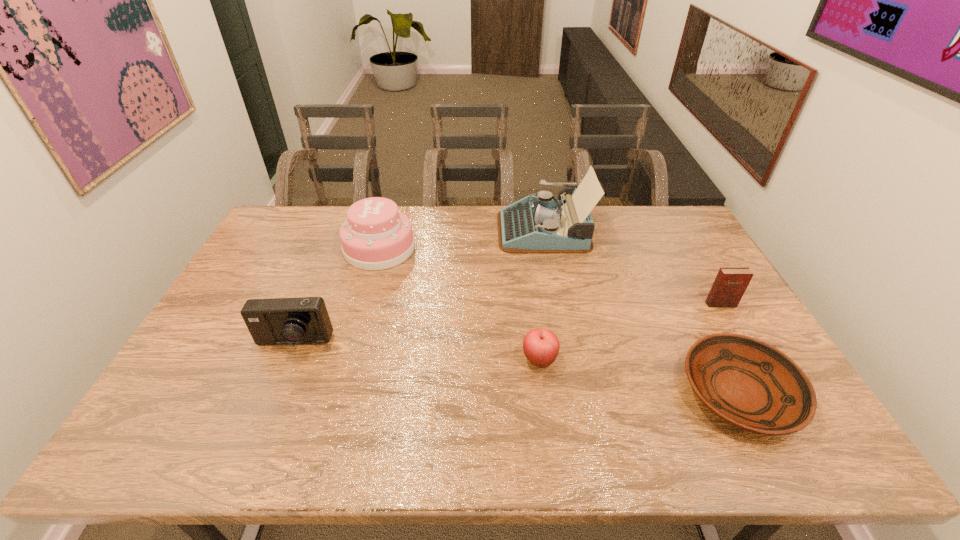
At what (x,y) coordinates should I click in order to perform the action: click on object that is at the near right corner. Please return your answer as a coordinate pair (x, y). The height and width of the screenshot is (540, 960). Looking at the image, I should click on (748, 383).

Identify the location of vacant space at the far edge of the desktop. The width and height of the screenshot is (960, 540). (412, 218).

In the image, there is a desktop. Where is `vacant space at the near edge`? The image size is (960, 540). vacant space at the near edge is located at coordinates (247, 458).

In the image, there is a desktop. Identify the location of vacant space at the left edge. Image resolution: width=960 pixels, height=540 pixels. (286, 272).

Image resolution: width=960 pixels, height=540 pixels. I want to click on vacant space at the near left corner of the desktop, so click(x=163, y=428).

In the image, there is a desktop. Where is `vacant area at the far right corner`? The width and height of the screenshot is (960, 540). vacant area at the far right corner is located at coordinates (661, 225).

Locate an element on the screen. free point between the tallest object and the fifth tallest object is located at coordinates (541, 294).

Locate an element on the screen. This screenshot has height=540, width=960. free space between the tallest object and the birthday cake is located at coordinates (462, 239).

Where is `free space that is in between the camera and the apple`? The width and height of the screenshot is (960, 540). free space that is in between the camera and the apple is located at coordinates (417, 351).

Locate an element on the screen. empty space between the tallest object and the second shortest object is located at coordinates (541, 294).